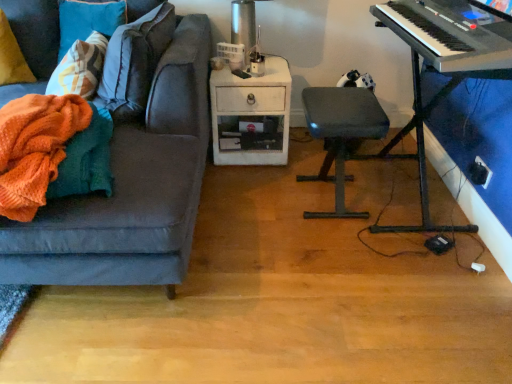
The width and height of the screenshot is (512, 384). What are the coordinates of `vacant area that is in front of black plastic keyboard at right` in the screenshot? It's located at (x=402, y=286).